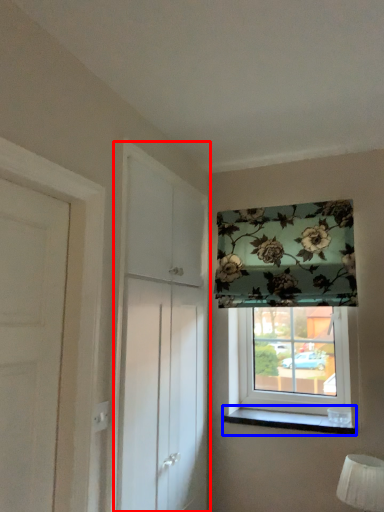
Question: Among these objects, which one is nearest to the camera, screen door (highlighted by a red box) or window sill (highlighted by a blue box)?

Choices:
 (A) screen door
 (B) window sill

Answer: (A)